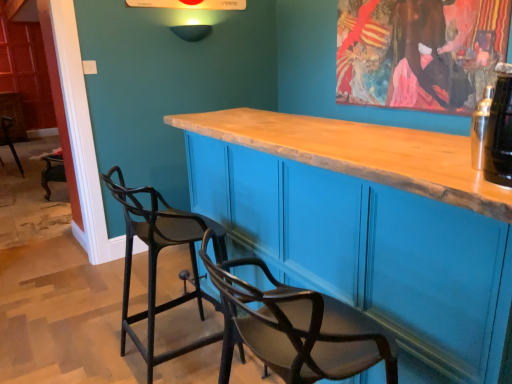
Question: Should I look upward or downward to see wooden cabinet at center?

Choices:
 (A) up
 (B) down

Answer: (B)

Question: Can we say wooden cabinet at center lies outside black glass bottle at upper right?

Choices:
 (A) no
 (B) yes

Answer: (B)

Question: Does wooden cabinet at center come behind black glass bottle at upper right?

Choices:
 (A) yes
 (B) no

Answer: (B)

Question: From a real-world perspective, is wooden cabinet at center on top of black glass bottle at upper right?

Choices:
 (A) yes
 (B) no

Answer: (B)

Question: From the image's perspective, is wooden cabinet at center below black glass bottle at upper right?

Choices:
 (A) yes
 (B) no

Answer: (A)

Question: Can you confirm if wooden cabinet at center is thinner than black glass bottle at upper right?

Choices:
 (A) yes
 (B) no

Answer: (B)

Question: Can black glass bottle at upper right be found inside wooden cabinet at center?

Choices:
 (A) yes
 (B) no

Answer: (B)

Question: Is wooden cabinet at center closer to the viewer compared to black matte chair at left, which is the first chair from front to back?

Choices:
 (A) no
 (B) yes

Answer: (B)

Question: From a real-world perspective, is wooden cabinet at center physically below black matte chair at left, acting as the 2th chair starting from the top?

Choices:
 (A) yes
 (B) no

Answer: (B)

Question: Is wooden cabinet at center at the right side of black matte chair at left, which is the first chair from front to back?

Choices:
 (A) no
 (B) yes

Answer: (B)

Question: From the image's perspective, is wooden cabinet at center located beneath black matte chair at left, the second chair viewed from the left?

Choices:
 (A) yes
 (B) no

Answer: (B)

Question: Is wooden cabinet at center turned away from black matte chair at left, which is the first chair from front to back?

Choices:
 (A) yes
 (B) no

Answer: (A)

Question: Is the depth of wooden cabinet at center greater than that of black matte chair at left, which is the 2th chair from back to front?

Choices:
 (A) yes
 (B) no

Answer: (B)

Question: Does black glass bottle at upper right have a greater width compared to wooden cabinet at center?

Choices:
 (A) yes
 (B) no

Answer: (B)